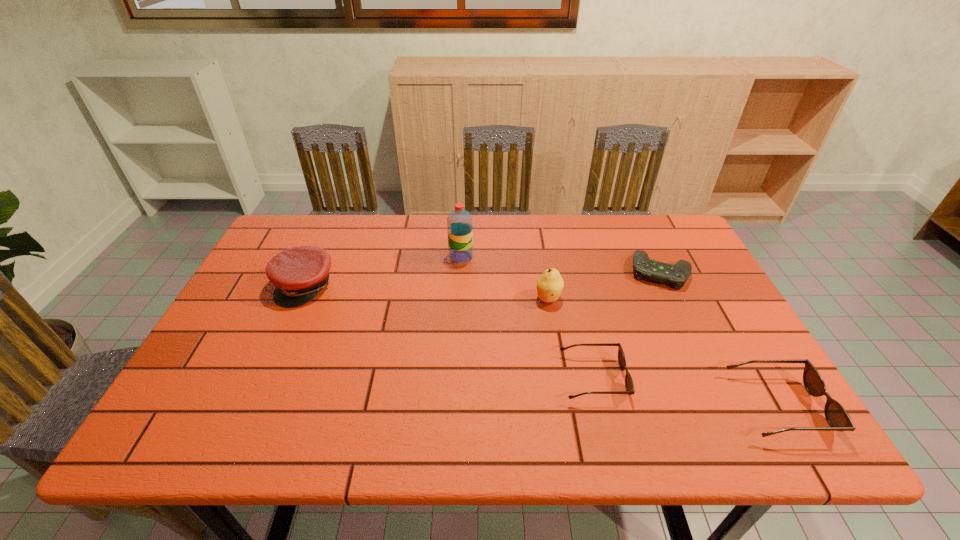
At what (x,y) coordinates should I click in order to perform the action: click on the left sunglasses. Please return your answer as a coordinate pair (x, y). The image size is (960, 540). Looking at the image, I should click on (629, 385).

The height and width of the screenshot is (540, 960). I want to click on the right sunglasses, so click(837, 417).

At what (x,y) coordinates should I click in order to perform the action: click on the fourth tallest object. Please return your answer as a coordinate pair (x, y). Looking at the image, I should click on (837, 417).

Locate an element on the screen. The image size is (960, 540). pear is located at coordinates (550, 284).

Image resolution: width=960 pixels, height=540 pixels. I want to click on the leftmost object, so click(299, 273).

Identify the location of cap. (299, 273).

The image size is (960, 540). Identify the location of the second object from left to right. (459, 222).

Locate an element on the screen. the tallest object is located at coordinates (459, 222).

Locate an element on the screen. Image resolution: width=960 pixels, height=540 pixels. control is located at coordinates (676, 275).

The height and width of the screenshot is (540, 960). Identify the location of vacant space located 0.200m on the front lenses of the left sunglasses. (712, 379).